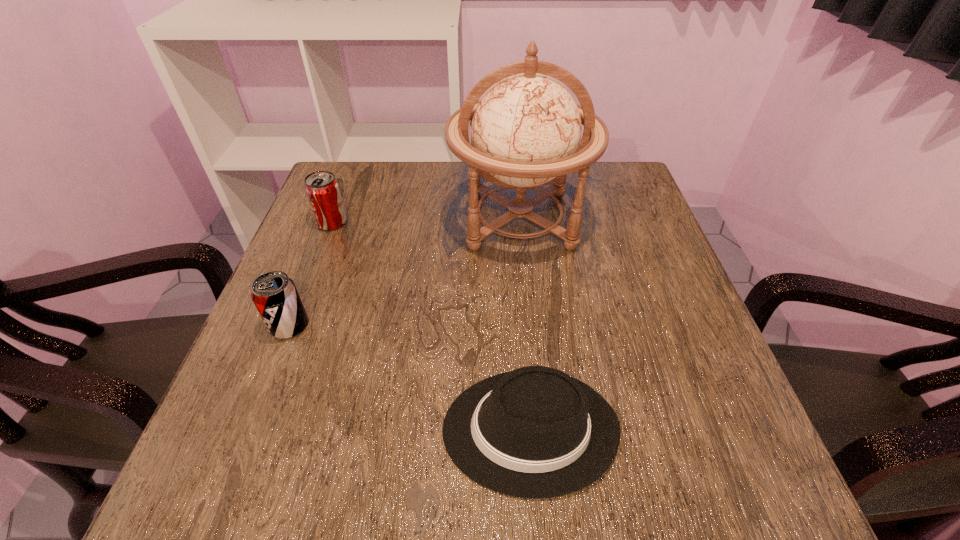
You are a GUI agent. You are given a task and a screenshot of the screen. Output one action in this format:
    pyautogui.click(x=<x>, y=<y>)
    Task: Click on the vacant space at the far right corner of the desktop
    
    Given the screenshot: What is the action you would take?
    pyautogui.click(x=622, y=192)

You are a GUI agent. You are given a task and a screenshot of the screen. Output one action in this format:
    pyautogui.click(x=<x>, y=<y>)
    Task: Click on the vacant region between the second nearest object and the nearest object
    The height and width of the screenshot is (540, 960).
    Given the screenshot: What is the action you would take?
    pyautogui.click(x=409, y=377)

Locate an element on the screen. vacant space in between the second nearest object and the farther soda can is located at coordinates (311, 274).

Where is `vacant space in between the nearest object and the nearer soda can`? This screenshot has width=960, height=540. vacant space in between the nearest object and the nearer soda can is located at coordinates (409, 377).

At what (x,y) coordinates should I click in order to perform the action: click on vacant space in between the farther soda can and the nearer soda can. Please return your answer as a coordinate pair (x, y). This screenshot has height=540, width=960. Looking at the image, I should click on (311, 274).

This screenshot has width=960, height=540. What are the coordinates of `free space between the shortest object and the globe` in the screenshot? It's located at (524, 325).

The width and height of the screenshot is (960, 540). What are the coordinates of `free point between the globe and the second nearest object` in the screenshot? It's located at (404, 272).

Identify the location of free space between the fedora and the third farthest object. The height and width of the screenshot is (540, 960). [409, 377].

Identify the location of vacant space in between the farther soda can and the second nearest object. The height and width of the screenshot is (540, 960). (311, 274).

The height and width of the screenshot is (540, 960). Identify the location of vacant area between the farther soda can and the nearer soda can. (311, 274).